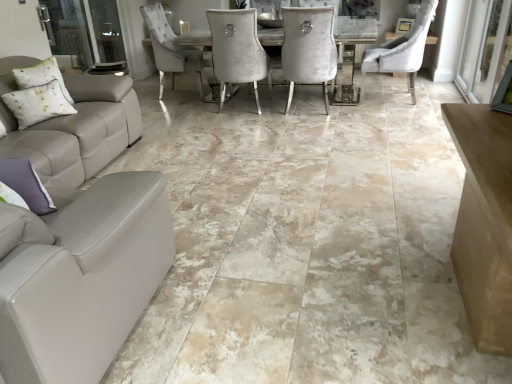
Where is `free point to the left of velvet white chair at center, arranged as the second chair when viewed from the right`? free point to the left of velvet white chair at center, arranged as the second chair when viewed from the right is located at coordinates (259, 111).